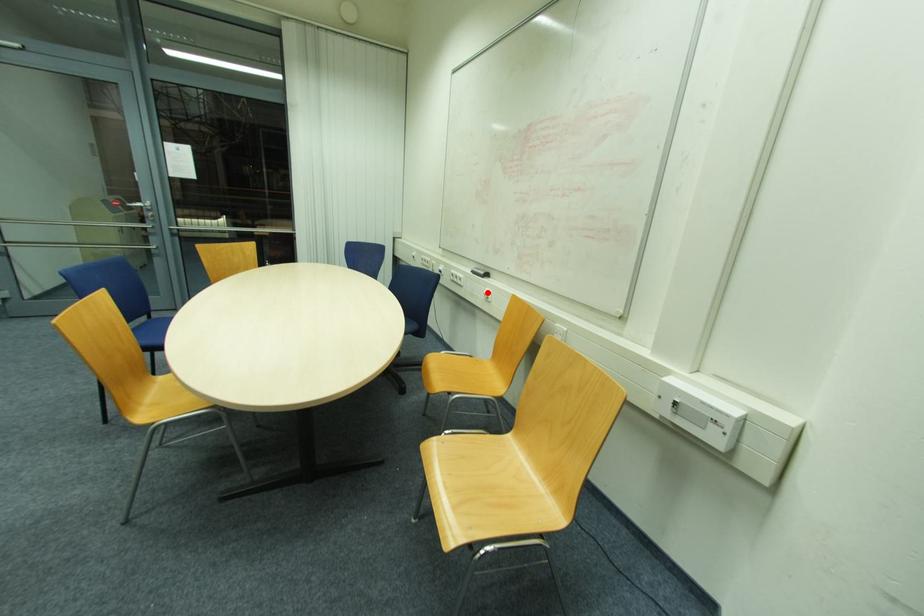
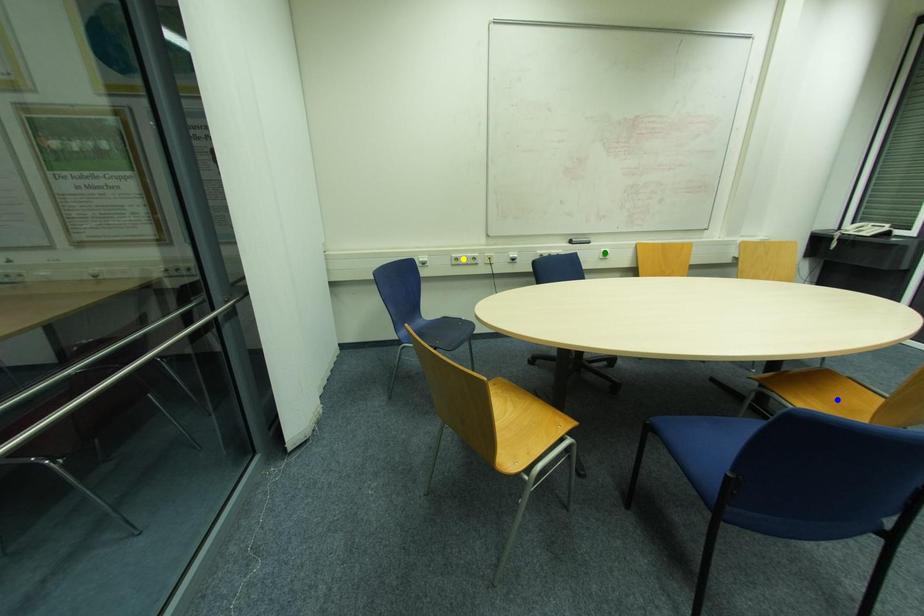
Question: I am providing you with two images of the same scene from different viewpoints. A red point is marked on the first image. You are given multiple points on the second image. Which mark in image 2 goes with the point in image 1?

Choices:
 (A) blue point
 (B) yellow point
 (C) green point

Answer: (C)